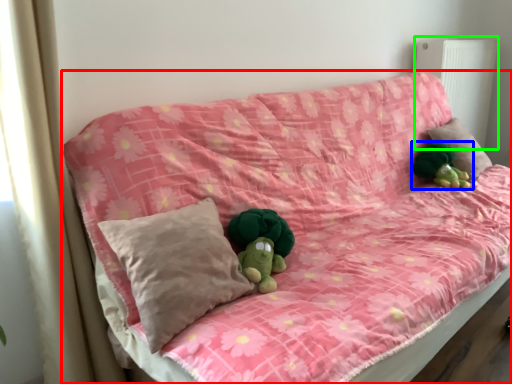
Question: Which object is the farthest from furniture (highlighted by a red box)? Choose among these: toy (highlighted by a blue box) or radiator (highlighted by a green box).

Choices:
 (A) toy
 (B) radiator

Answer: (B)